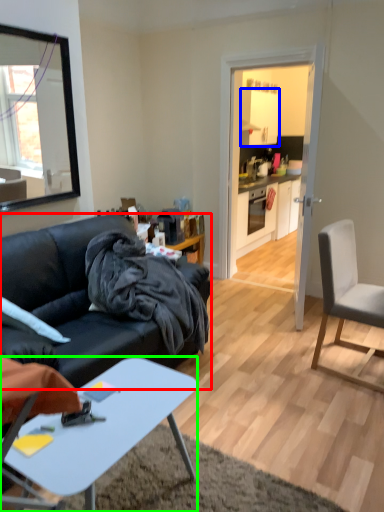
Question: Which object is the closest to the studio couch (highlighted by a red box)? Choose among these: cabinetry (highlighted by a blue box) or desk (highlighted by a green box).

Choices:
 (A) cabinetry
 (B) desk

Answer: (B)